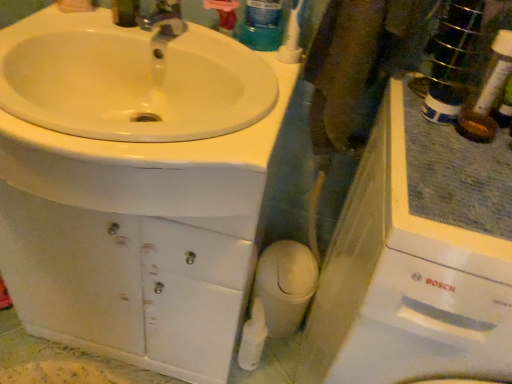
In order to face translucent plastic mouthwash at upper center, should I rotate leftwards or rightwards?

It's best to rotate right around 1.484 degrees.

The height and width of the screenshot is (384, 512). Identify the location of white plastic toothbrush at upper right. (291, 37).

Is translucent plastic mouthwash at upper center far away from white plastic toothbrush at upper right?

No, translucent plastic mouthwash at upper center is in close proximity to white plastic toothbrush at upper right.

This screenshot has height=384, width=512. Find the location of `toothbrush in front of the translucent plastic mouthwash at upper center`. toothbrush in front of the translucent plastic mouthwash at upper center is located at coordinates (291, 37).

In the image, is translucent plastic mouthwash at upper center positioned in front of or behind white plastic toothbrush at upper right?

In the image, translucent plastic mouthwash at upper center appears behind white plastic toothbrush at upper right.

From a real-world perspective, is white plastic toothbrush at upper right on white glossy sink at upper left?

Yes.

Does white plastic toothbrush at upper right have a lesser height compared to white glossy sink at upper left?

No.

Is white plastic toothbrush at upper right further to camera compared to white glossy sink at upper left?

Yes, it is behind white glossy sink at upper left.

Based on the photo, is white plastic toothbrush at upper right to the left or to the right of white glossy sink at upper left in the image?

white plastic toothbrush at upper right is positioned on white glossy sink at upper left's right side.

Is translucent plastic mouthwash at upper center not inside white glossy sink at upper left?

translucent plastic mouthwash at upper center is positioned outside white glossy sink at upper left.

Considering the relative positions of translucent plastic mouthwash at upper center and white glossy sink at upper left in the image provided, is translucent plastic mouthwash at upper center to the right of white glossy sink at upper left from the viewer's perspective?

Indeed, translucent plastic mouthwash at upper center is positioned on the right side of white glossy sink at upper left.

Considering the sizes of objects translucent plastic mouthwash at upper center and white glossy sink at upper left in the image provided, who is smaller, translucent plastic mouthwash at upper center or white glossy sink at upper left?

translucent plastic mouthwash at upper center.

Could you tell me if translucent plastic mouthwash at upper center is facing white glossy sink at upper left?

No.

How distant is white plastic toothbrush at upper right from translucent plastic mouthwash at upper center?

white plastic toothbrush at upper right and translucent plastic mouthwash at upper center are 2.13 inches apart from each other.

Who is more distant, white plastic toothbrush at upper right or translucent plastic mouthwash at upper center?

translucent plastic mouthwash at upper center.

The image size is (512, 384). I want to click on toothbrush on the right of the translucent plastic mouthwash at upper center, so click(291, 37).

Is white plastic toothbrush at upper right smaller than translucent plastic mouthwash at upper center?

Indeed, white plastic toothbrush at upper right has a smaller size compared to translucent plastic mouthwash at upper center.

Can you confirm if white glossy sink at upper left is positioned to the right of white plastic toothbrush at upper right?

No, white glossy sink at upper left is not to the right of white plastic toothbrush at upper right.

Considering the sizes of objects white glossy sink at upper left and white plastic toothbrush at upper right in the image provided, who is shorter, white glossy sink at upper left or white plastic toothbrush at upper right?

With less height is white glossy sink at upper left.

From the image's perspective, is white glossy sink at upper left on white plastic toothbrush at upper right?

No.

Between white glossy sink at upper left and white plastic toothbrush at upper right, which one has smaller size?

white plastic toothbrush at upper right is smaller.

How distant is white glossy sink at upper left from translucent plastic mouthwash at upper center?

The distance of white glossy sink at upper left from translucent plastic mouthwash at upper center is 13.88 inches.

From the picture: Between white glossy sink at upper left and translucent plastic mouthwash at upper center, which one appears on the left side from the viewer's perspective?

white glossy sink at upper left.

Which of these two, white glossy sink at upper left or translucent plastic mouthwash at upper center, is wider?

Wider between the two is white glossy sink at upper left.

Considering the relative sizes of white glossy sink at upper left and translucent plastic mouthwash at upper center in the image provided, is white glossy sink at upper left bigger than translucent plastic mouthwash at upper center?

Yes, white glossy sink at upper left is bigger than translucent plastic mouthwash at upper center.

The image size is (512, 384). Find the location of `mouthwash above the white plastic toothbrush at upper right (from a real-world perspective)`. mouthwash above the white plastic toothbrush at upper right (from a real-world perspective) is located at coordinates (262, 25).

This screenshot has height=384, width=512. Find the location of `toothbrush to the right of white glossy sink at upper left`. toothbrush to the right of white glossy sink at upper left is located at coordinates (291, 37).

From the image, which object appears to be nearer to white plastic toothbrush at upper right, translucent plastic mouthwash at upper center or white glossy sink at upper left?

translucent plastic mouthwash at upper center is closer to white plastic toothbrush at upper right.

Estimate the real-world distances between objects in this image. Which object is further from translucent plastic mouthwash at upper center, white glossy sink at upper left or white plastic toothbrush at upper right?

white glossy sink at upper left.

Based on their spatial positions, is white plastic toothbrush at upper right or translucent plastic mouthwash at upper center closer to white glossy sink at upper left?

white plastic toothbrush at upper right lies closer to white glossy sink at upper left than the other object.

When comparing their distances from white glossy sink at upper left, does translucent plastic mouthwash at upper center or white plastic toothbrush at upper right seem further?

translucent plastic mouthwash at upper center lies further to white glossy sink at upper left than the other object.

Looking at the image, which one is located further to translucent plastic mouthwash at upper center, white plastic toothbrush at upper right or white glossy sink at upper left?

The object further to translucent plastic mouthwash at upper center is white glossy sink at upper left.

From the picture: When comparing their distances from white plastic toothbrush at upper right, does white glossy sink at upper left or translucent plastic mouthwash at upper center seem closer?

translucent plastic mouthwash at upper center lies closer to white plastic toothbrush at upper right than the other object.

The width and height of the screenshot is (512, 384). I want to click on toothbrush between translucent plastic mouthwash at upper center and white glossy sink at upper left from top to bottom, so click(x=291, y=37).